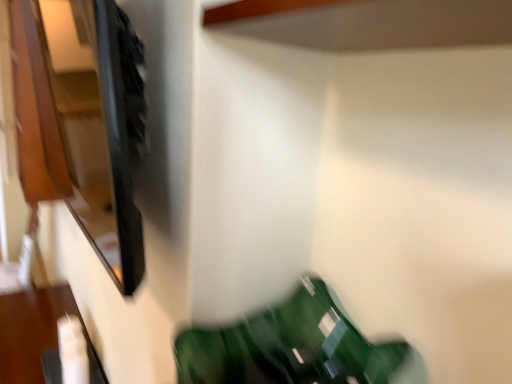
Question: Could you tell me if matte black cabinet at upper left is turned towards green glossy bean bag chair at lower center?

Choices:
 (A) yes
 (B) no

Answer: (B)

Question: Can you confirm if matte black cabinet at upper left is positioned to the left of green glossy bean bag chair at lower center?

Choices:
 (A) yes
 (B) no

Answer: (A)

Question: Is matte black cabinet at upper left not within green glossy bean bag chair at lower center?

Choices:
 (A) yes
 (B) no

Answer: (A)

Question: Can you confirm if matte black cabinet at upper left is taller than green glossy bean bag chair at lower center?

Choices:
 (A) yes
 (B) no

Answer: (A)

Question: Considering the relative positions of matte black cabinet at upper left and green glossy bean bag chair at lower center in the image provided, is matte black cabinet at upper left to the right of green glossy bean bag chair at lower center from the viewer's perspective?

Choices:
 (A) yes
 (B) no

Answer: (B)

Question: Is green glossy bean bag chair at lower center at the back of matte black cabinet at upper left?

Choices:
 (A) yes
 (B) no

Answer: (B)

Question: Is matte black cabinet at upper left looking in the opposite direction of white glossy remote control at lower left?

Choices:
 (A) no
 (B) yes

Answer: (A)

Question: From a real-world perspective, is matte black cabinet at upper left located beneath white glossy remote control at lower left?

Choices:
 (A) yes
 (B) no

Answer: (B)

Question: From a real-world perspective, is matte black cabinet at upper left on top of white glossy remote control at lower left?

Choices:
 (A) no
 (B) yes

Answer: (B)

Question: Considering the relative sizes of matte black cabinet at upper left and white glossy remote control at lower left in the image provided, is matte black cabinet at upper left taller than white glossy remote control at lower left?

Choices:
 (A) yes
 (B) no

Answer: (A)

Question: Is matte black cabinet at upper left behind white glossy remote control at lower left?

Choices:
 (A) yes
 (B) no

Answer: (B)

Question: Is matte black cabinet at upper left at the left side of white glossy remote control at lower left?

Choices:
 (A) yes
 (B) no

Answer: (B)

Question: Is green glossy bean bag chair at lower center shorter than matte black cabinet at upper left?

Choices:
 (A) no
 (B) yes

Answer: (B)